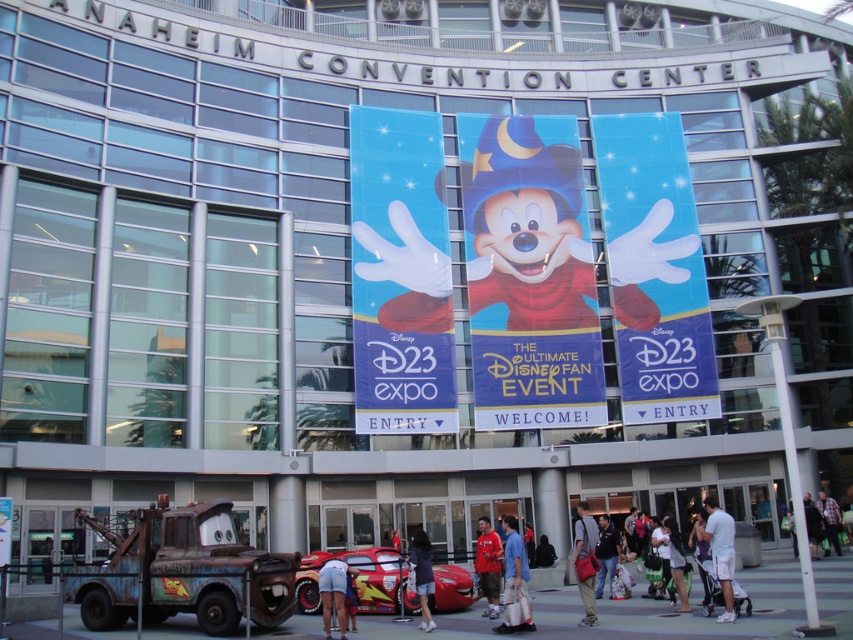
Question: Which object appears closest to the camera in this image?

Choices:
 (A) plaid fabric shirt at lower right
 (B) red cotton shirt at center

Answer: (B)

Question: In this image, where is shiny red car at center located relative to blue fabric shirt at center?

Choices:
 (A) right
 (B) left

Answer: (B)

Question: Does white glossy hand at upper center appear on the right side of white cotton shirt at center?

Choices:
 (A) no
 (B) yes

Answer: (B)

Question: Which of the following is the closest to the observer?

Choices:
 (A) blue glossy banner at center
 (B) light blue shorts at center

Answer: (B)

Question: Which object is positioned farthest from the shiny red car at center?

Choices:
 (A) light blue shorts at center
 (B) white glossy glove at center
 (C) dark blue jacket at center

Answer: (B)

Question: Is white glossy glove at center to the right of white cotton shirt at center from the viewer's perspective?

Choices:
 (A) no
 (B) yes

Answer: (A)